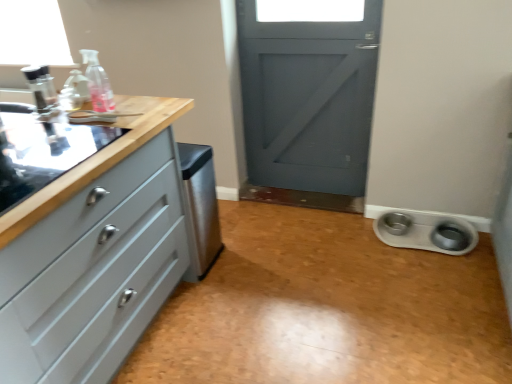
Question: Based on their positions, is white glossy pet bowls at lower right located to the left or right of satin stainless steel dishwasher at center?

Choices:
 (A) left
 (B) right

Answer: (B)

Question: Is white glossy pet bowls at lower right taller or shorter than satin stainless steel dishwasher at center?

Choices:
 (A) tall
 (B) short

Answer: (B)

Question: Which of these objects is positioned farthest from the satin stainless steel dishwasher at center?

Choices:
 (A) white plastic pet bowls at lower right
 (B) white glossy pet bowls at lower right
 (C) black glass sink at left
 (D) transparent plastic bottle at upper left
 (E) matte gray chest of drawers at left

Answer: (A)

Question: Which of these objects is positioned closest to the matte gray chest of drawers at left?

Choices:
 (A) black glass sink at left
 (B) satin stainless steel dishwasher at center
 (C) white plastic pet bowls at lower right
 (D) transparent plastic bottle at upper left
 (E) white glossy pet bowls at lower right

Answer: (A)